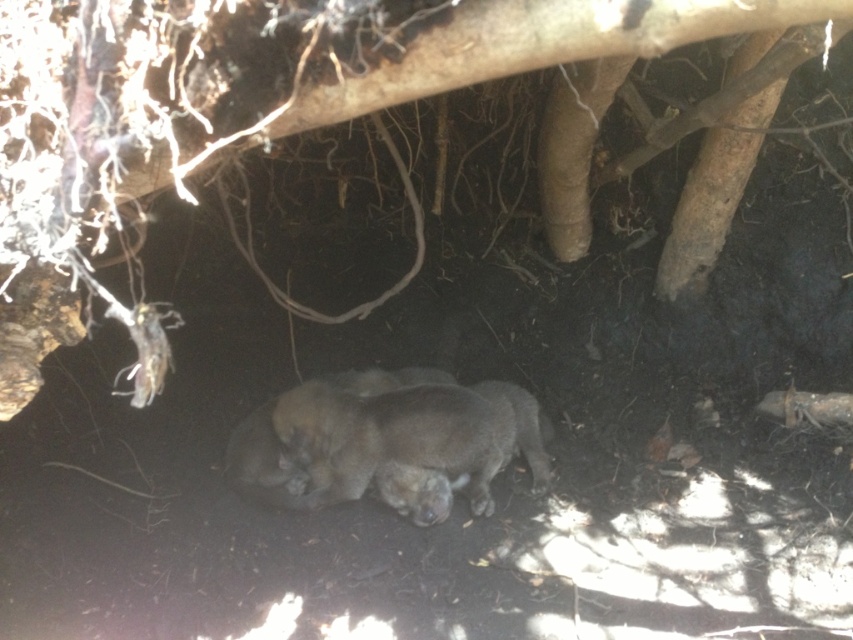
You are a hiker who wants to take a photo of the fuzzy gray animal at center without blocking the view of the brown rough tree trunk at center. Which object should you position yourself below to ensure the tree trunk doesn

To take a photo of the fuzzy gray animal at center without blocking the view of the brown rough tree trunk at center, you should position yourself below the brown rough tree trunk at center. Since the tree trunk is above the animal, placing yourself below the tree trunk will allow you to capture both the animal and the tree trunk in the frame without obstruction.

You are standing in the shaded area under the tree and notice a point marked at coordinates (538, 44). What object does this point correspond to in the scene?

The point at coordinates (538, 44) corresponds to the brown rough tree trunk at center.